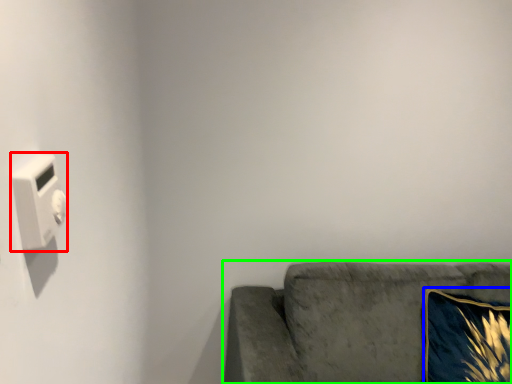
Question: Which object is positioned closest to light switch (highlighted by a red box)? Select from throw pillow (highlighted by a blue box) and studio couch (highlighted by a green box).

Choices:
 (A) throw pillow
 (B) studio couch

Answer: (B)